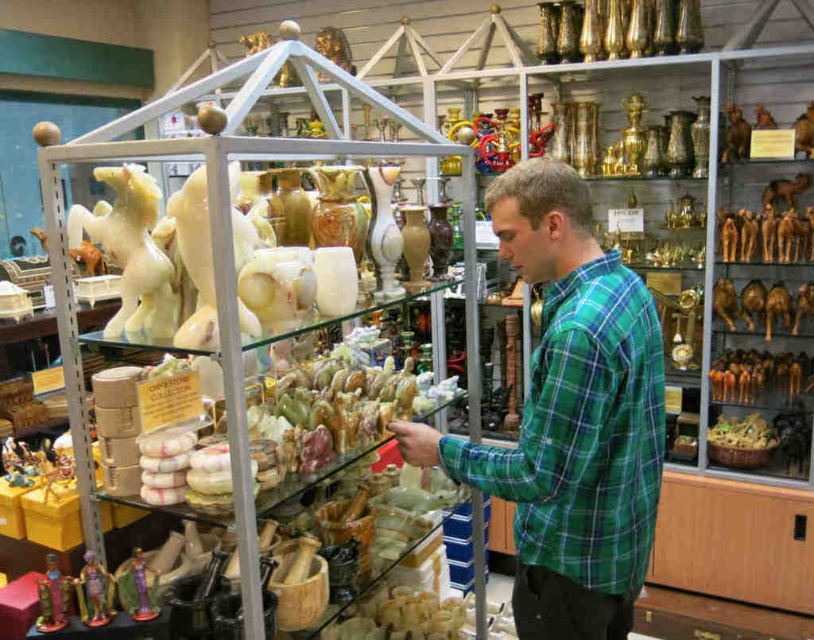
Between point (606, 566) and point (128, 609), which one is positioned in front?

Positioned in front is point (128, 609).

Between green plaid shirt at center and purple glossy figurine at lower left, which one is positioned lower?

purple glossy figurine at lower left

What are the coordinates of `green plaid shirt at center` in the screenshot? It's located at (570, 417).

Which is above, white glossy horse at center or shiny gold figurine at lower left?

white glossy horse at center is higher up.

Is white glossy horse at center wider than shiny gold figurine at lower left?

Yes.

Find the location of `white glossy horse at center`. white glossy horse at center is located at coordinates (130, 253).

Find the location of a particular element. The height and width of the screenshot is (640, 814). white glossy horse at center is located at coordinates (130, 253).

Does metallic gold figurine at lower left have a smaller size compared to shiny gold figurine at lower left?

Indeed, metallic gold figurine at lower left has a smaller size compared to shiny gold figurine at lower left.

Is point (88, 596) positioned behind point (51, 564)?

No.

Is point (106, 572) in front of point (68, 620)?

No, (106, 572) is further to viewer.

Where is `metallic gold figurine at lower left`? metallic gold figurine at lower left is located at coordinates (94, 593).